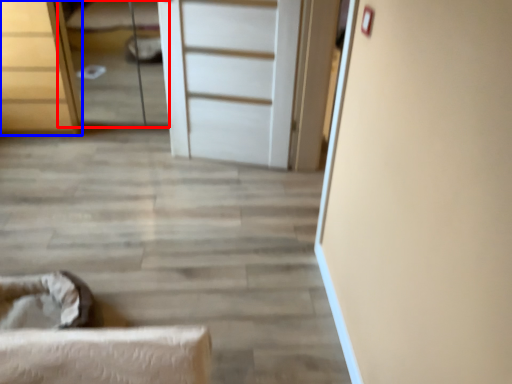
Question: Which point is further to the camera, bed (highlighted by a red box) or chest of drawers (highlighted by a blue box)?

Choices:
 (A) bed
 (B) chest of drawers

Answer: (A)